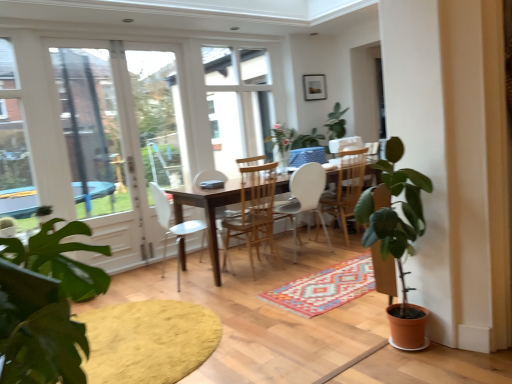
This screenshot has width=512, height=384. What are the coordinates of `vacant area situated to the left side of white plastic chair at center, the 4th chair in the right-to-left sequence` in the screenshot? It's located at (136, 280).